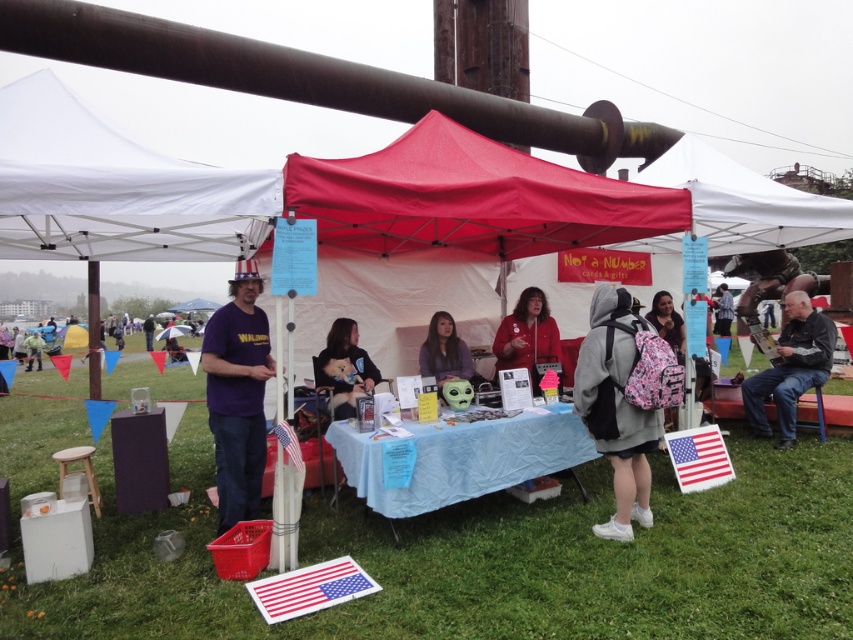
You are standing at the edge of the vendor area and notice a red fabric canopy at center and a matte purple shirt at center. Which object is positioned higher from the ground?

The red fabric canopy at center is above matte purple shirt at center, so it is positioned higher from the ground.

You are standing at the point with coordinates (469, 198) in the image. What object is located exactly at this point?

The red fabric canopy at center is located exactly at point (469, 198).